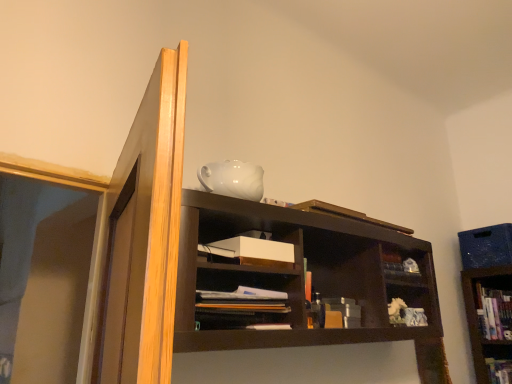
How much space does wooden book at upper center, which is counted as the first book, starting from the front, occupy vertically?

It is 2.52 inches.

You are a GUI agent. You are given a task and a screenshot of the screen. Output one action in this format:
    pyautogui.click(x=<x>, y=<y>)
    Task: Click on the multicolored fabric book at upper center, arranged as the 1th book when ordered from the bottom
    
    Given the screenshot: What is the action you would take?
    pyautogui.click(x=499, y=370)

Measure the distance between hardcover book at upper right, which appears as the 2th book when viewed from the top, and camera.

hardcover book at upper right, which appears as the 2th book when viewed from the top, is 2.32 meters from camera.

What is the approximate height of white matte paper at center?

3.87 inches.

This screenshot has width=512, height=384. Describe the element at coordinates (252, 251) in the screenshot. I see `white matte paper at center` at that location.

Locate an element on the screen. The image size is (512, 384). matte brown books at center is located at coordinates (243, 298).

What are the coordinates of `wooden book at upper center, the 3th book in the bottom-to-top sequence` in the screenshot? It's located at (346, 214).

Does matte brown books at center appear on the right side of wooden book at upper center, the 3th book in the bottom-to-top sequence?

No, matte brown books at center is not to the right of wooden book at upper center, the 3th book in the bottom-to-top sequence.

Where is `shelf that appears in front of the wooden book at upper center, the 3th book in the bottom-to-top sequence`? The width and height of the screenshot is (512, 384). shelf that appears in front of the wooden book at upper center, the 3th book in the bottom-to-top sequence is located at coordinates (243, 298).

From the picture: Is matte brown books at center outside of wooden book at upper center, the 3th book in the bottom-to-top sequence?

Yes.

Based on their sizes in the image, would you say matte brown books at center is bigger or smaller than wooden book at upper center, the 3th book in the bottom-to-top sequence?

In the image, matte brown books at center appears to be larger than wooden book at upper center, the 3th book in the bottom-to-top sequence.

Considering the sizes of objects multicolored fabric book at upper center, the second book from the front, and white matte paper at center in the image provided, who is wider, multicolored fabric book at upper center, the second book from the front, or white matte paper at center?

multicolored fabric book at upper center, the second book from the front.

Which is more to the right, multicolored fabric book at upper center, positioned as the second book in right-to-left order, or white matte paper at center?

multicolored fabric book at upper center, positioned as the second book in right-to-left order.

You are a GUI agent. You are given a task and a screenshot of the screen. Output one action in this format:
    pyautogui.click(x=<x>, y=<y>)
    Task: Click on the paperback book positioned vertically above the multicolored fabric book at upper center, the second book from the front (from a real-world perspective)
    This screenshot has width=512, height=384.
    Given the screenshot: What is the action you would take?
    pyautogui.click(x=252, y=251)

Consider the image. From a real-world perspective, is multicolored fabric book at upper center, which ranks as the 3th book in top-to-bottom order, on top of white matte paper at center?

No.

Considering the positions of point (289, 260) and point (244, 291), is point (289, 260) closer or farther from the camera than point (244, 291)?

Point (289, 260).

From the image's perspective, is white matte paper at center positioned above or below matte brown books at center?

Based on their image positions, white matte paper at center is located above matte brown books at center.

Measure the distance from white matte paper at center to matte brown books at center.

white matte paper at center is 5.96 inches from matte brown books at center.

Looking at this image, considering the relative positions of white matte paper at center and matte brown books at center in the image provided, is white matte paper at center to the left of matte brown books at center from the viewer's perspective?

Correct, you'll find white matte paper at center to the left of matte brown books at center.

Which object is closer to the camera, hardcover book at upper right, acting as the third book starting from the left, or white matte paper at center?

white matte paper at center is in front.

From a real-world perspective, is hardcover book at upper right, positioned as the 3th book in front-to-back order, positioned above or below white matte paper at center?

From a real-world perspective, hardcover book at upper right, positioned as the 3th book in front-to-back order, is physically below white matte paper at center.

How many degrees apart are the facing directions of hardcover book at upper right, acting as the third book starting from the left, and white matte paper at center?

hardcover book at upper right, acting as the third book starting from the left, and white matte paper at center are facing 89.5 degrees away from each other.

From the picture: Measure the distance between hardcover book at upper right, positioned as the 3th book in front-to-back order, and white matte paper at center.

hardcover book at upper right, positioned as the 3th book in front-to-back order, is 5.71 feet from white matte paper at center.

Based on their sizes in the image, would you say matte brown books at center is bigger or smaller than multicolored fabric book at upper center, positioned as the second book in left-to-right order?

Clearly, matte brown books at center is larger in size than multicolored fabric book at upper center, positioned as the second book in left-to-right order.

Which book is the 2nd one when counting from the back of the matte brown books at center? Please provide its 2D coordinates.

[(499, 370)]

Is point (211, 329) positioned after point (492, 381)?

No.

Is multicolored fabric book at upper center, arranged as the 1th book when ordered from the bottom, taller or shorter than wooden book at upper center, which is the 1th book in left-to-right order?

Clearly, multicolored fabric book at upper center, arranged as the 1th book when ordered from the bottom, is taller compared to wooden book at upper center, which is the 1th book in left-to-right order.

From the image's perspective, does multicolored fabric book at upper center, which ranks as the 3th book in top-to-bottom order, appear higher than wooden book at upper center, which is counted as the first book, starting from the front?

No, from the image's perspective, multicolored fabric book at upper center, which ranks as the 3th book in top-to-bottom order, is not above wooden book at upper center, which is counted as the first book, starting from the front.

Could you tell me if multicolored fabric book at upper center, which ranks as the 3th book in top-to-bottom order, is facing wooden book at upper center, which is the 1th book in left-to-right order?

Yes, multicolored fabric book at upper center, which ranks as the 3th book in top-to-bottom order, is aimed at wooden book at upper center, which is the 1th book in left-to-right order.

What's the angular difference between multicolored fabric book at upper center, which ranks as the 3th book in top-to-bottom order, and wooden book at upper center, which is counted as the first book, starting from the front,'s facing directions?

They differ by 94.2 degrees in their facing directions.

Does wooden book at upper center, which is the 1th book in left-to-right order, appear on the left side of white matte paper at center?

Incorrect, wooden book at upper center, which is the 1th book in left-to-right order, is not on the left side of white matte paper at center.

Would you consider wooden book at upper center, the 3th book when ordered from back to front, to be distant from white matte paper at center?

No.

Which object is further away from the camera, wooden book at upper center, which is the 1th book in left-to-right order, or white matte paper at center?

wooden book at upper center, which is the 1th book in left-to-right order, is behind.

Which of these two, wooden book at upper center, which is counted as the first book, starting from the front, or white matte paper at center, is smaller?

wooden book at upper center, which is counted as the first book, starting from the front, is smaller.

I want to click on shelf in front of the wooden book at upper center, the 3th book in the bottom-to-top sequence, so click(x=243, y=298).

The width and height of the screenshot is (512, 384). Find the location of `the 2nd book to the right of the white matte paper at center, starting your count from the anchor`. the 2nd book to the right of the white matte paper at center, starting your count from the anchor is located at coordinates (499, 370).

Considering their positions, is wooden book at upper center, which is counted as the first book, starting from the front, positioned further to matte brown books at center than white matte paper at center?

wooden book at upper center, which is counted as the first book, starting from the front, is further to matte brown books at center.

Estimate the real-world distances between objects in this image. Which object is closer to multicolored fabric book at upper center, positioned as the second book in right-to-left order, wooden book at upper center, which is counted as the first book, starting from the front, or white matte paper at center?

wooden book at upper center, which is counted as the first book, starting from the front, lies closer to multicolored fabric book at upper center, positioned as the second book in right-to-left order, than the other object.

Based on their spatial positions, is matte brown books at center or multicolored fabric book at upper center, arranged as the 1th book when ordered from the bottom, closer to wooden book at upper center, which is the 1th book in left-to-right order?

Among the two, matte brown books at center is located nearer to wooden book at upper center, which is the 1th book in left-to-right order.

Estimate the real-world distances between objects in this image. Which object is further from white matte paper at center, multicolored fabric book at upper center, which ranks as the 3th book in top-to-bottom order, or wooden book at upper center, the 3th book in the bottom-to-top sequence?

Among the two, multicolored fabric book at upper center, which ranks as the 3th book in top-to-bottom order, is located further to white matte paper at center.

When comparing their distances from multicolored fabric book at upper center, the second book from the front, does wooden book at upper center, the 3th book in the bottom-to-top sequence, or hardcover book at upper right, acting as the third book starting from the left, seem further?

Among the two, wooden book at upper center, the 3th book in the bottom-to-top sequence, is located further to multicolored fabric book at upper center, the second book from the front.

Looking at this image, which object lies further to the anchor point wooden book at upper center, which ranks as the 1th book in top-to-bottom order, matte brown books at center or white matte paper at center?

matte brown books at center is positioned further to the anchor wooden book at upper center, which ranks as the 1th book in top-to-bottom order.

Estimate the real-world distances between objects in this image. Which object is closer to hardcover book at upper right, positioned as the 3th book in front-to-back order, white matte paper at center or multicolored fabric book at upper center, the second book from the front?

The object closer to hardcover book at upper right, positioned as the 3th book in front-to-back order, is multicolored fabric book at upper center, the second book from the front.

Looking at the image, which one is located further to wooden book at upper center, the 3th book in the bottom-to-top sequence, matte brown books at center or hardcover book at upper right, which is counted as the first book, starting from the right?

The object further to wooden book at upper center, the 3th book in the bottom-to-top sequence, is hardcover book at upper right, which is counted as the first book, starting from the right.

You are a GUI agent. You are given a task and a screenshot of the screen. Output one action in this format:
    pyautogui.click(x=<x>, y=<y>)
    Task: Click on the shelf between white matte paper at center and wooden book at upper center, which is the 1th book in left-to-right order, in the horizontal direction
    The width and height of the screenshot is (512, 384).
    Given the screenshot: What is the action you would take?
    pyautogui.click(x=243, y=298)

Identify the location of book situated between wooden book at upper center, which ranks as the 1th book in top-to-bottom order, and hardcover book at upper right, which ranks as the 2th book in bottom-to-top order, from left to right. This screenshot has width=512, height=384. (499, 370).

Find the location of a particular element. The height and width of the screenshot is (384, 512). book between matte brown books at center and multicolored fabric book at upper center, which is counted as the second book, starting from the back is located at coordinates click(346, 214).

Locate an element on the screen. The image size is (512, 384). book situated between white matte paper at center and multicolored fabric book at upper center, which is counted as the second book, starting from the back, from left to right is located at coordinates (346, 214).